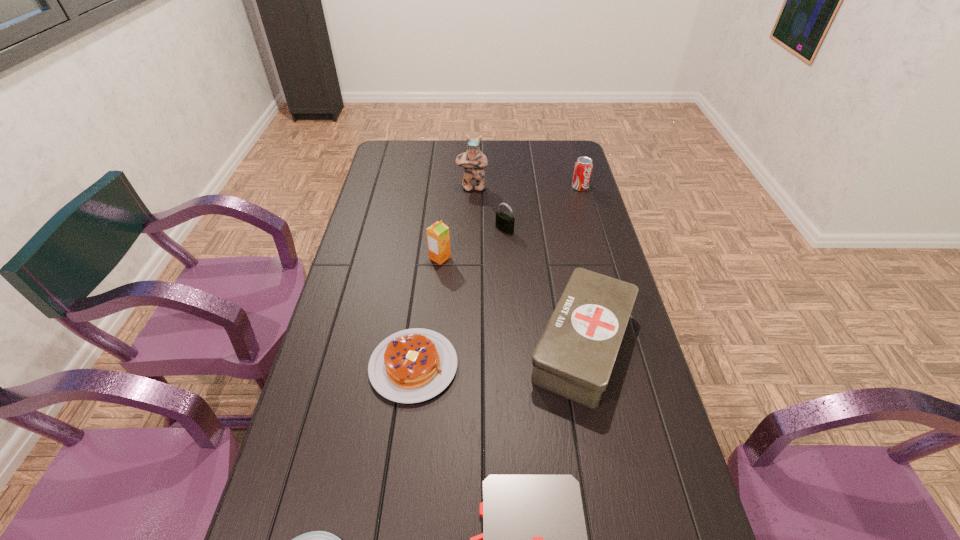
Identify the location of the tallest object. (473, 161).

The width and height of the screenshot is (960, 540). I want to click on the seventh shortest object, so click(x=438, y=238).

Locate an element on the screen. The image size is (960, 540). the fourth farthest object is located at coordinates (438, 238).

Find the location of a particular element. soda can is located at coordinates pyautogui.click(x=583, y=166).

Locate an element on the screen. The image size is (960, 540). the farther first-aid kit is located at coordinates (574, 358).

Find the location of `padlock`. padlock is located at coordinates (504, 222).

This screenshot has width=960, height=540. Identify the location of the farther pancake. (413, 365).

Identify the location of free space located 0.340m on the front-facing side of the figurine. (470, 251).

Find the location of a particular element. Image resolution: width=960 pixels, height=540 pixels. vacant space situated 0.060m on the right of the second tallest object is located at coordinates (469, 258).

At what (x,y) coordinates should I click in order to perform the action: click on vacant area located on the front of the soda can. Please return your answer as a coordinate pair (x, y). Looking at the image, I should click on (598, 252).